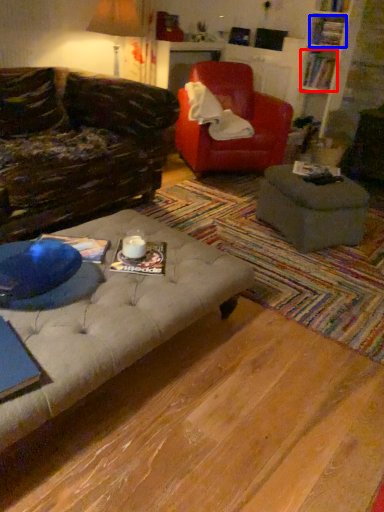
Question: Among these objects, which one is farthest to the camera, book (highlighted by a red box) or book (highlighted by a blue box)?

Choices:
 (A) book
 (B) book

Answer: (A)